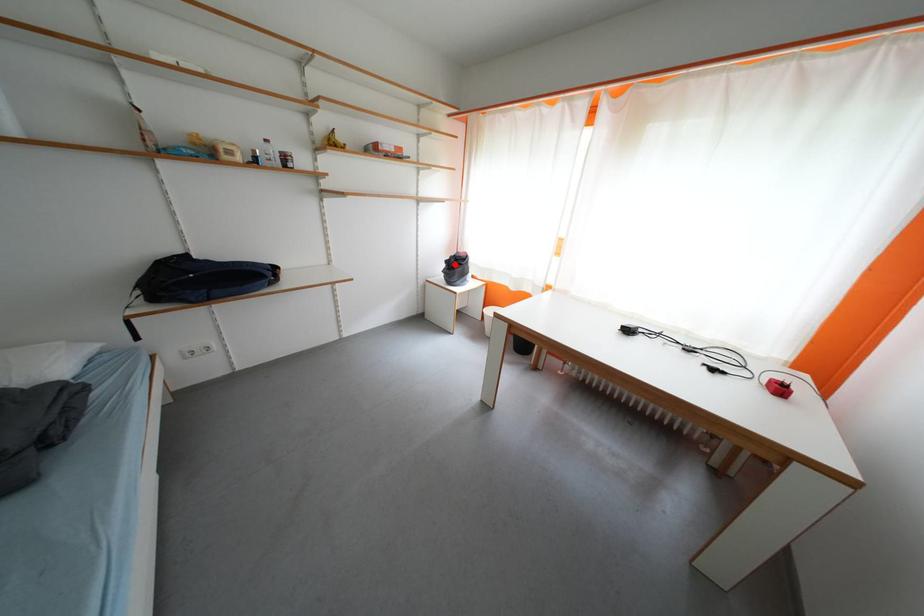
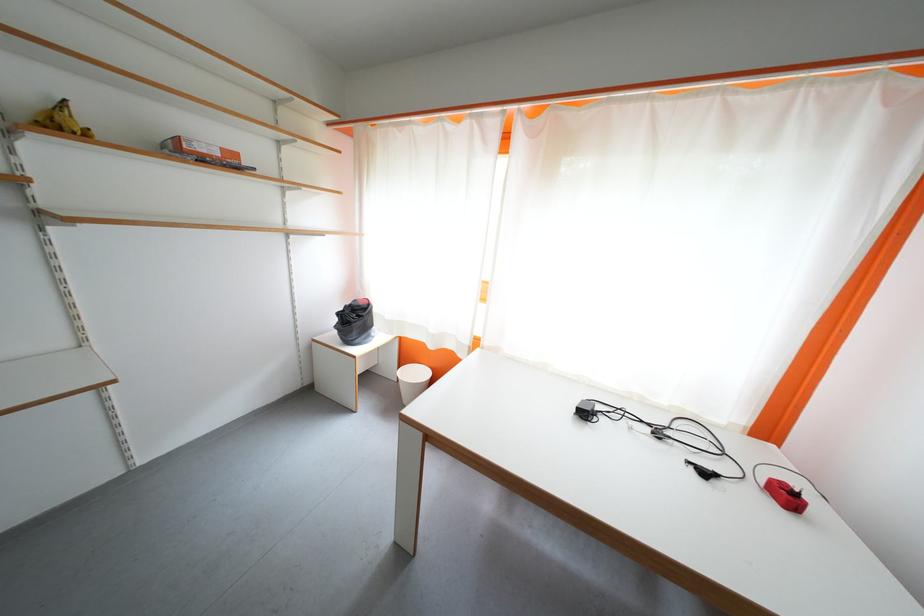
Question: I am providing you with two images of the same scene from different viewpoints. Given a red point in image1, look at the same physical point in image2. Is it:

Choices:
 (A) Closer to the viewpoint
 (B) Farther from the viewpoint

Answer: (B)